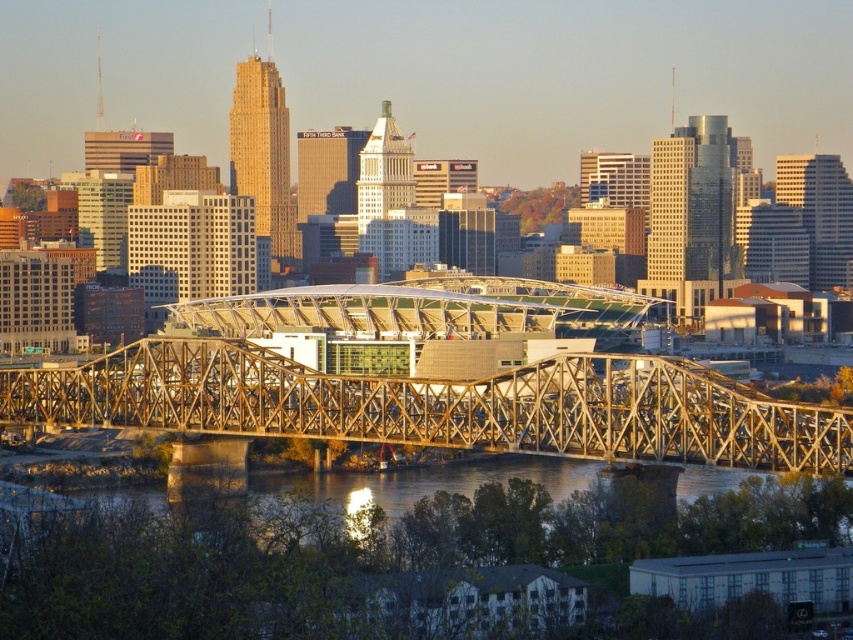
You are a tourist standing on the golden metallic bridge at center. You want to take a photo of the greenish water at lower center. Which direction should you look to capture it in your shot?

The greenish water at lower center is located beneath the golden metallic bridge at center, so you should look downward to capture it in your photo.

You are a delivery drone flying at an altitude of 15 meters above the greenish water at lower center. You need to land on the golden metallic bridge at center. Can you safely descend directly to the bridge without hitting any obstacles?

The golden metallic bridge at center is 13.64 meters away from the greenish water at lower center. Since the drone is flying at 15 meters above the water, it can safely descend to the bridge as the vertical distance is less than the drone altitude, allowing for a safe landing.

You are a tourist standing on the riverbank looking at the golden metallic bridge at center and the greenish water at lower center. Which object is positioned to the right side from your viewpoint?

The golden metallic bridge at center is positioned to the right of the greenish water at lower center, so the golden metallic bridge at center is on the right side from your viewpoint.